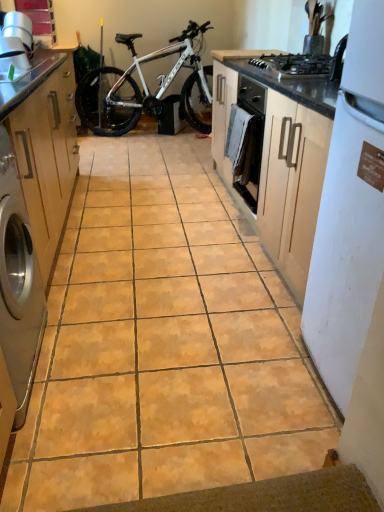
Question: Is satin silver washing machine at left inside the boundaries of white matte bicycle at center, or outside?

Choices:
 (A) outside
 (B) inside

Answer: (A)

Question: Is satin silver washing machine at left to the left or to the right of white matte bicycle at center in the image?

Choices:
 (A) right
 (B) left

Answer: (B)

Question: Estimate the real-world distances between objects in this image. Which object is closer to the matte wood cabinet at left?

Choices:
 (A) satin silver washing machine at left
 (B) black matte gas stove at upper right
 (C) white matte bicycle at center
 (D) white matte refrigerator at right

Answer: (A)

Question: Considering the real-world distances, which object is closest to the white matte refrigerator at right?

Choices:
 (A) black matte gas stove at upper right
 (B) matte wood cabinet at left
 (C) satin silver washing machine at left
 (D) white matte bicycle at center

Answer: (C)